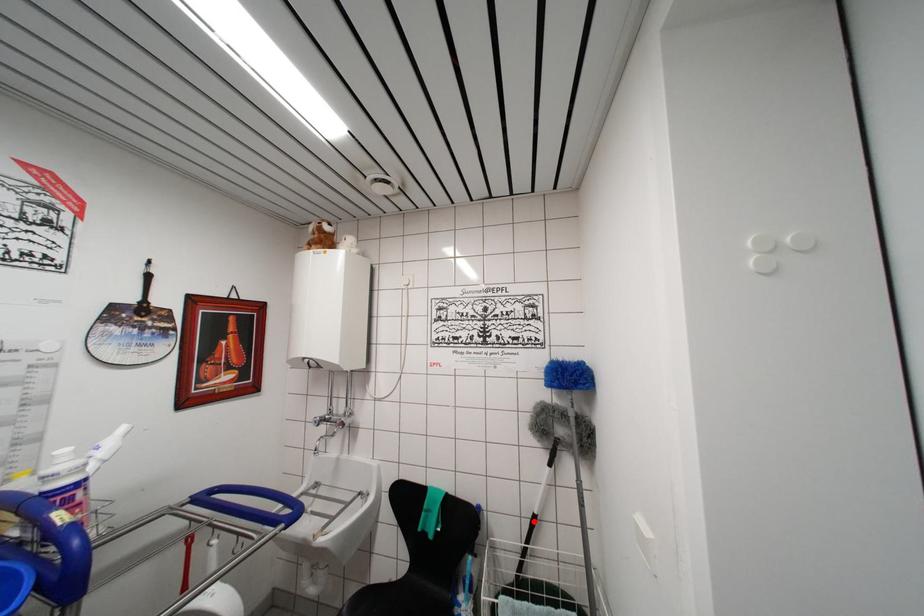
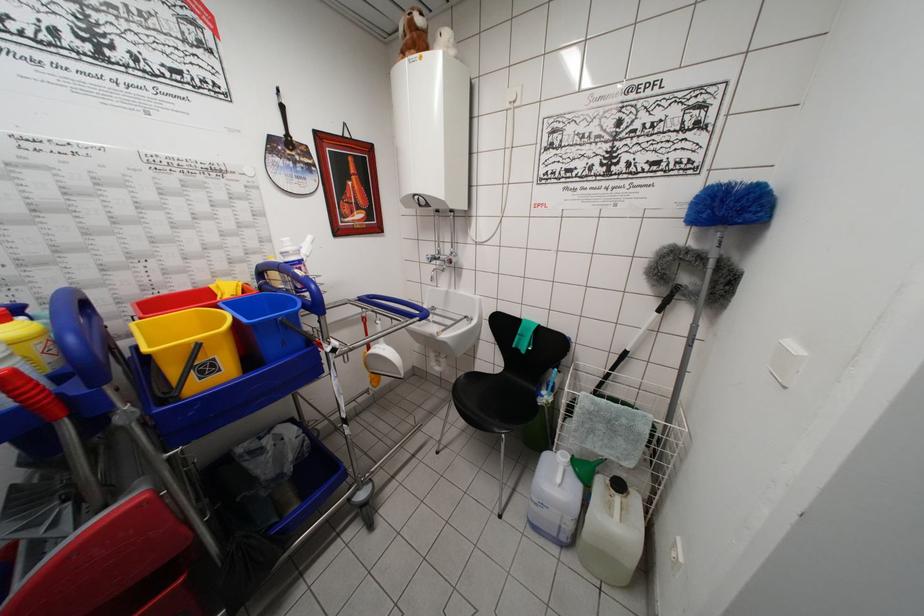
Question: I am providing you with two images of the same scene from different viewpoints. In image1, a red point is highlighted. Considering the same 3D point in image2, which of the following is correct?

Choices:
 (A) It is closer
 (B) It is farther

Answer: (A)